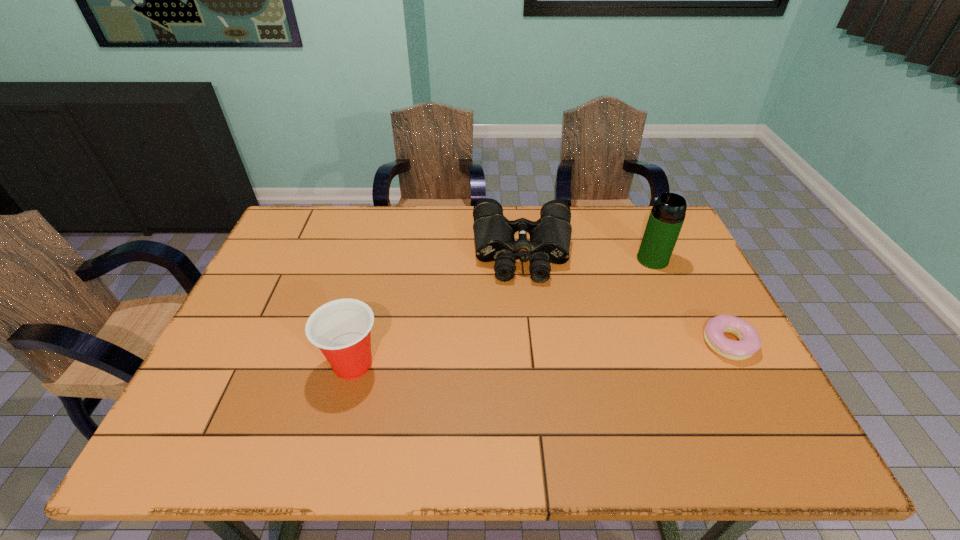
The image size is (960, 540). I want to click on the second tallest object, so pos(341,329).

Locate an element on the screen. Image resolution: width=960 pixels, height=540 pixels. cup is located at coordinates [x=341, y=329].

Locate an element on the screen. the shortest object is located at coordinates (749, 342).

You are a GUI agent. You are given a task and a screenshot of the screen. Output one action in this format:
    pyautogui.click(x=<x>, y=<y>)
    Task: Click on the third tallest object
    
    Given the screenshot: What is the action you would take?
    point(550,236)

Find the location of `the third object from right to left`. the third object from right to left is located at coordinates (550, 236).

This screenshot has width=960, height=540. I want to click on the tallest object, so click(x=667, y=215).

You are a GUI agent. You are given a task and a screenshot of the screen. Output one action in this format:
    pyautogui.click(x=<x>, y=<y>)
    Task: Click on the free location located on the right of the second tallest object
    The image size is (960, 540).
    Given the screenshot: What is the action you would take?
    pyautogui.click(x=404, y=364)

Where is `free region located 0.320m on the left of the shortest object`? The width and height of the screenshot is (960, 540). free region located 0.320m on the left of the shortest object is located at coordinates (576, 343).

Identify the location of free location located 0.180m through the eyepieces of the second object from left to right. This screenshot has height=540, width=960. (528, 333).

Locate an element on the screen. The image size is (960, 540). vacant point located 0.350m through the eyepieces of the second object from left to right is located at coordinates (531, 390).